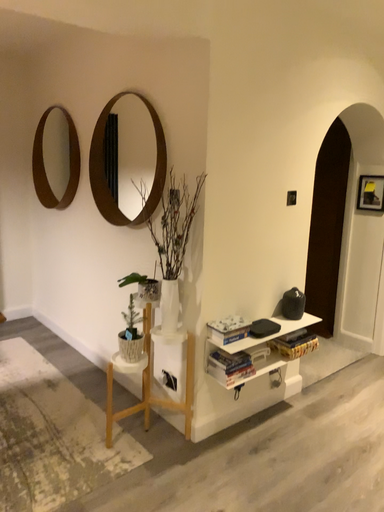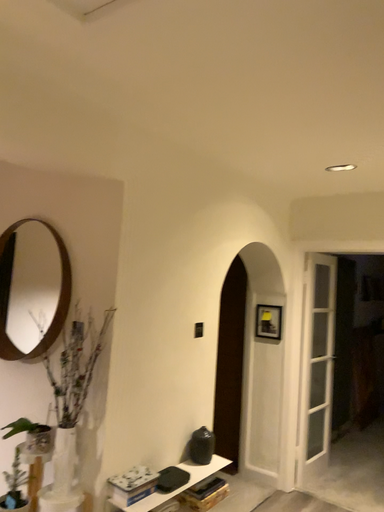
Question: How did the camera likely rotate when shooting the video?

Choices:
 (A) rotated right
 (B) rotated left

Answer: (A)